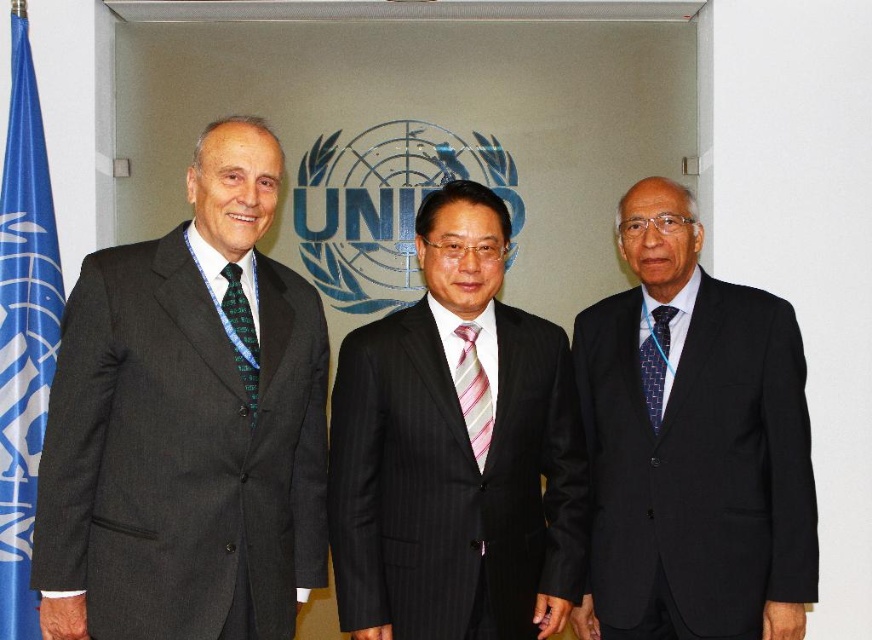
Is matte black suit at left thinner than blue textured tie at right?

No.

Who is positioned more to the right, matte black suit at left or blue textured tie at right?

blue textured tie at right

You are a GUI agent. You are given a task and a screenshot of the screen. Output one action in this format:
    pyautogui.click(x=<x>, y=<y>)
    Task: Click on the matte black suit at left
    
    Given the screenshot: What is the action you would take?
    pyautogui.click(x=186, y=426)

The width and height of the screenshot is (872, 640). Identify the location of matte black suit at left. (186, 426).

Does dark gray pinstripe suit at center appear on the right side of green textured tie at left?

Indeed, dark gray pinstripe suit at center is positioned on the right side of green textured tie at left.

Is point (523, 449) positioned after point (239, 330)?

That is True.

Is point (427, 317) more distant than point (247, 381)?

Yes, it is behind point (247, 381).

You are a GUI agent. You are given a task and a screenshot of the screen. Output one action in this format:
    pyautogui.click(x=<x>, y=<y>)
    Task: Click on the dark gray pinstripe suit at center
    
    Given the screenshot: What is the action you would take?
    pyautogui.click(x=455, y=449)

Is matte black suit at left to the right of dark gray pinstripe suit at center from the viewer's perspective?

No, matte black suit at left is not to the right of dark gray pinstripe suit at center.

The height and width of the screenshot is (640, 872). What are the coordinates of `matte black suit at left` in the screenshot? It's located at (186, 426).